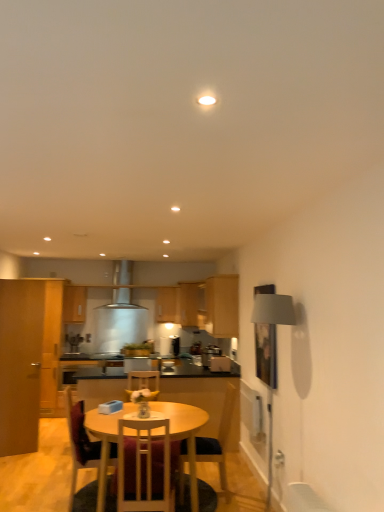
What do you see at coordinates (222, 306) in the screenshot?
I see `wooden cabinet at center, the 2th cabinetry when ordered from front to back` at bounding box center [222, 306].

Identify the location of wooden cabinet at center, arranged as the fifth cabinetry when viewed from the left. (222, 306).

Consider the image. In order to face white wood chair at center, positioned as the first chair in front-to-back order, should I rotate leftwards or rightwards?

Turn left approximately 5.929 degrees to face it.

Locate an element on the screen. The width and height of the screenshot is (384, 512). wooden chair at center, which ranks as the 1th chair in back-to-front order is located at coordinates (143, 383).

The height and width of the screenshot is (512, 384). What do you see at coordinates (79, 442) in the screenshot?
I see `wooden chair at lower center, the 3th chair when ordered from back to front` at bounding box center [79, 442].

Find the location of a particular element. This screenshot has height=512, width=384. wooden round table at center is located at coordinates (184, 434).

Could satin silver toaster at center, arranged as the 2th appliance when viewed from the right, be considered to be inside satin black toaster at center, placed as the 3th appliance when sorted from right to left?

That's incorrect, satin silver toaster at center, arranged as the 2th appliance when viewed from the right, is not inside satin black toaster at center, placed as the 3th appliance when sorted from right to left.

Which object is more forward, satin black toaster at center, placed as the 1th appliance when sorted from left to right, or satin silver toaster at center, arranged as the 2th appliance when viewed from the right?

satin silver toaster at center, arranged as the 2th appliance when viewed from the right, is closer to the camera.

Looking at this image, is satin black toaster at center, placed as the 3th appliance when sorted from right to left, taller than satin silver toaster at center, which is the second appliance from back to front?

Yes, satin black toaster at center, placed as the 3th appliance when sorted from right to left, is taller than satin silver toaster at center, which is the second appliance from back to front.

Considering the sizes of objects satin black toaster at center, placed as the 3th appliance when sorted from right to left, and satin silver toaster at center, the 2th appliance when ordered from left to right, in the image provided, who is wider, satin black toaster at center, placed as the 3th appliance when sorted from right to left, or satin silver toaster at center, the 2th appliance when ordered from left to right,?

satin silver toaster at center, the 2th appliance when ordered from left to right.

Which of these two, matte wood cabinet at left, arranged as the first cabinetry when viewed from the left, or satin black toaster at center, arranged as the 3th appliance when viewed from the front, is wider?

satin black toaster at center, arranged as the 3th appliance when viewed from the front, is wider.

Consider the image. Considering the relative positions of matte wood cabinet at left, arranged as the first cabinetry when viewed from the left, and satin black toaster at center, placed as the 3th appliance when sorted from right to left, in the image provided, is matte wood cabinet at left, arranged as the first cabinetry when viewed from the left, in front of satin black toaster at center, placed as the 3th appliance when sorted from right to left,?

Yes, the depth of matte wood cabinet at left, arranged as the first cabinetry when viewed from the left, is less than that of satin black toaster at center, placed as the 3th appliance when sorted from right to left.

Is matte wood cabinet at left, which appears as the fifth cabinetry when viewed from the back, not close to satin black toaster at center, arranged as the 3th appliance when viewed from the front?

Yes.

What's the angular difference between matte wood cabinet at center, arranged as the third cabinetry when viewed from the left, and matte wood cabinet at left, the second cabinetry from the back,'s facing directions?

The angle between the facing direction of matte wood cabinet at center, arranged as the third cabinetry when viewed from the left, and the facing direction of matte wood cabinet at left, the second cabinetry from the back, is 0.000293 degrees.

Could you tell me if matte wood cabinet at center, which ranks as the 3th cabinetry in right-to-left order, is turned towards matte wood cabinet at left, the second cabinetry from the back?

No, matte wood cabinet at center, which ranks as the 3th cabinetry in right-to-left order, is not aimed at matte wood cabinet at left, the second cabinetry from the back.

Does point (179, 288) appear closer or farther from the camera than point (76, 302)?

Point (179, 288).

From a real-world perspective, does matte wood cabinet at center, which ranks as the 3th cabinetry in right-to-left order, sit lower than matte wood cabinet at left, marked as the 4th cabinetry in a right-to-left arrangement?

Yes.

Is satin silver coffee machine at center at the right side of matte wood cabinet at left, which is the 4th cabinetry from front to back?

No, satin silver coffee machine at center is not to the right of matte wood cabinet at left, which is the 4th cabinetry from front to back.

Between satin silver coffee machine at center and matte wood cabinet at left, marked as the 4th cabinetry in a right-to-left arrangement, which one is positioned in front?

matte wood cabinet at left, marked as the 4th cabinetry in a right-to-left arrangement, is more forward.

Between point (76, 341) and point (64, 296), which one is positioned behind?

Positioned behind is point (76, 341).

Considering the relative sizes of satin silver coffee machine at center and matte wood cabinet at left, which is the 4th cabinetry from front to back, in the image provided, is satin silver coffee machine at center smaller than matte wood cabinet at left, which is the 4th cabinetry from front to back,?

Yes, satin silver coffee machine at center is smaller than matte wood cabinet at left, which is the 4th cabinetry from front to back.

The image size is (384, 512). In order to click on the 3rd chair counting from the left of the satin silver toaster at center, placed as the second appliance when sorted from front to back in this screenshot , I will do `click(143, 383)`.

Which is more to the left, satin silver toaster at center, placed as the second appliance when sorted from front to back, or wooden chair at center, which is the 4th chair in front-to-back order?

Positioned to the left is wooden chair at center, which is the 4th chair in front-to-back order.

Is satin silver toaster at center, placed as the second appliance when sorted from front to back, in front of or behind wooden chair at center, which is the 4th chair in front-to-back order, in the image?

In the image, satin silver toaster at center, placed as the second appliance when sorted from front to back, appears behind wooden chair at center, which is the 4th chair in front-to-back order.

Considering the sizes of objects satin black toaster at center, the 1th appliance in the back-to-front sequence, and matte wood cabinet at left, marked as the 4th cabinetry in a right-to-left arrangement, in the image provided, who is taller, satin black toaster at center, the 1th appliance in the back-to-front sequence, or matte wood cabinet at left, marked as the 4th cabinetry in a right-to-left arrangement,?

Standing taller between the two is matte wood cabinet at left, marked as the 4th cabinetry in a right-to-left arrangement.

Would you say satin black toaster at center, the 1th appliance in the back-to-front sequence, is outside matte wood cabinet at left, marked as the 4th cabinetry in a right-to-left arrangement?

Indeed, satin black toaster at center, the 1th appliance in the back-to-front sequence, is completely outside matte wood cabinet at left, marked as the 4th cabinetry in a right-to-left arrangement.

You are a GUI agent. You are given a task and a screenshot of the screen. Output one action in this format:
    pyautogui.click(x=<x>, y=<y>)
    Task: Click on the cabinetry that is the 4th one when counting upward from the satin black toaster at center, arranged as the 3th appliance when viewed from the front (from the image's perspective)
    The image size is (384, 512).
    Given the screenshot: What is the action you would take?
    pyautogui.click(x=74, y=304)

Considering the positions of objects satin black toaster at center, placed as the 1th appliance when sorted from left to right, and matte wood cabinet at left, marked as the 4th cabinetry in a right-to-left arrangement, in the image provided, who is more to the left, satin black toaster at center, placed as the 1th appliance when sorted from left to right, or matte wood cabinet at left, marked as the 4th cabinetry in a right-to-left arrangement,?

Positioned to the left is matte wood cabinet at left, marked as the 4th cabinetry in a right-to-left arrangement.

Which object is more forward, matte wood cabinet at center, which is the fifth cabinetry from front to back, or satin silver toaster at center, which is the second appliance from back to front?

satin silver toaster at center, which is the second appliance from back to front, is in front.

Is matte wood cabinet at center, arranged as the third cabinetry when viewed from the left, at the left side of satin silver toaster at center, placed as the second appliance when sorted from front to back?

Correct, you'll find matte wood cabinet at center, arranged as the third cabinetry when viewed from the left, to the left of satin silver toaster at center, placed as the second appliance when sorted from front to back.

From a real-world perspective, is matte wood cabinet at center, arranged as the third cabinetry when viewed from the left, located higher than satin silver toaster at center, placed as the second appliance when sorted from front to back?

Correct, in the physical world, matte wood cabinet at center, arranged as the third cabinetry when viewed from the left, is higher than satin silver toaster at center, placed as the second appliance when sorted from front to back.

Is matte wood cabinet at center, which ranks as the 3th cabinetry in right-to-left order, touching satin silver toaster at center, the 2th appliance when ordered from left to right?

No, matte wood cabinet at center, which ranks as the 3th cabinetry in right-to-left order, is not with satin silver toaster at center, the 2th appliance when ordered from left to right.

From the image's perspective, which appliance is the 2nd one above the satin black toaster at center, placed as the 3th appliance when sorted from right to left? Please provide its 2D coordinates.

[(210, 354)]

Find the location of a particular element. This screenshot has height=512, width=384. the 4th cabinetry in front of the satin black toaster at center, arranged as the 3th appliance when viewed from the front, starting your count from the anchor is located at coordinates (28, 358).

Estimate the real-world distances between objects in this image. Which object is closer to matte wood cabinet at left, which is the 4th cabinetry from front to back, metallic silver toaster at center, the first appliance when ordered from front to back, or satin silver exhaust hood at center?

satin silver exhaust hood at center is positioned closer to the anchor matte wood cabinet at left, which is the 4th cabinetry from front to back.

When comparing their distances from satin silver exhaust hood at center, does matte wood cabinet at upper center, which is the second cabinetry from right to left, or white wood chair at center, positioned as the first chair in front-to-back order, seem closer?

matte wood cabinet at upper center, which is the second cabinetry from right to left.

When comparing their distances from wooden round table at center, does wooden cabinet at center, arranged as the fifth cabinetry when viewed from the left, or wooden chair at center, which ranks as the 1th chair in back-to-front order, seem further?

The object further to wooden round table at center is wooden cabinet at center, arranged as the fifth cabinetry when viewed from the left.

Based on their spatial positions, is satin silver toaster at center, placed as the second appliance when sorted from front to back, or satin silver exhaust hood at center closer to satin black toaster at center, placed as the 3th appliance when sorted from right to left?

Based on the image, satin silver toaster at center, placed as the second appliance when sorted from front to back, appears to be nearer to satin black toaster at center, placed as the 3th appliance when sorted from right to left.

Based on their spatial positions, is wooden round table at center or matte wood cabinet at upper center, the 4th cabinetry when ordered from left to right, further from matte wood cabinet at left, which appears as the fifth cabinetry when viewed from the back?

wooden round table at center is positioned further to the anchor matte wood cabinet at left, which appears as the fifth cabinetry when viewed from the back.

Based on their spatial positions, is wooden round table at center or metallic silver toaster at center, the third appliance viewed from the left, further from satin silver coffee machine at center?

Among the two, wooden round table at center is located further to satin silver coffee machine at center.

From the image, which object appears to be nearer to satin silver exhaust hood at center, matte wood cabinet at left, the second cabinetry from the back, or metallic silver toaster at center, the third appliance viewed from the left?

matte wood cabinet at left, the second cabinetry from the back, is closer to satin silver exhaust hood at center.

When comparing their distances from satin silver toaster at center, the 2th appliance when ordered from left to right, does satin black toaster at center, placed as the 3th appliance when sorted from right to left, or wooden chair at center, which is counted as the 2th chair, starting from the back, seem closer?

satin black toaster at center, placed as the 3th appliance when sorted from right to left.

Find the location of a particular element. The height and width of the screenshot is (512, 384). exhaust hood between wooden chair at lower center, marked as the 2th chair in a front-to-back arrangement, and satin silver coffee machine at center, along the z-axis is located at coordinates (122, 284).

In order to click on chair between matte wood cabinet at left, acting as the 5th cabinetry starting from the right, and wooden chair at center, which is the 4th chair in front-to-back order, from left to right in this screenshot , I will do `click(79, 442)`.

The image size is (384, 512). What are the coordinates of `appliance between wooden cabinet at center, placed as the first cabinetry when sorted from right to left, and metallic silver toaster at center, acting as the 3th appliance starting from the back, in the vertical direction` in the screenshot? It's located at (210, 354).

Locate an element on the screen. exhaust hood between white wood chair at center, positioned as the 4th chair in back-to-front order, and satin silver coffee machine at center from front to back is located at coordinates (122, 284).